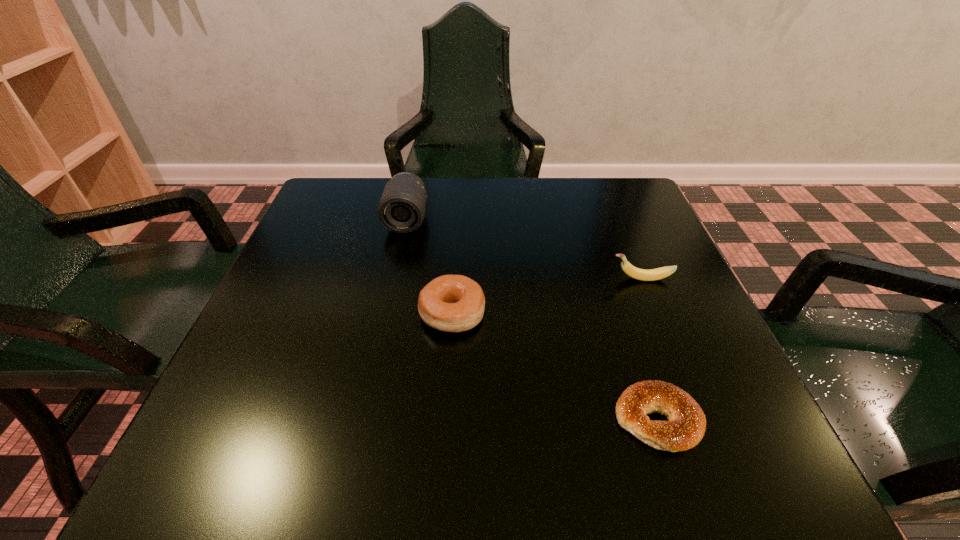
Locate an element on the screen. The height and width of the screenshot is (540, 960). free space between the third object from right to left and the third nearest object is located at coordinates (546, 296).

This screenshot has width=960, height=540. What are the coordinates of `empty space that is in between the leftmost object and the third nearest object` in the screenshot? It's located at (524, 249).

At what (x,y) coordinates should I click in order to perform the action: click on free spot between the second farthest object and the leftmost object. Please return your answer as a coordinate pair (x, y). Looking at the image, I should click on (524, 249).

At what (x,y) coordinates should I click in order to perform the action: click on vacant space in between the farthest object and the farther bagel. Please return your answer as a coordinate pair (x, y). The height and width of the screenshot is (540, 960). Looking at the image, I should click on (429, 267).

The width and height of the screenshot is (960, 540). Find the location of `empty space between the banana and the leftmost object`. empty space between the banana and the leftmost object is located at coordinates (524, 249).

Select which object is the third closest to the second farthest object. Please provide its 2D coordinates. Your answer should be formatted as a tuple, i.e. [(x, y)], where the tuple contains the x and y coordinates of a point satisfying the conditions above.

[(401, 209)]

Locate an element on the screen. This screenshot has height=540, width=960. the second closest object to the nearer bagel is located at coordinates pos(659,273).

Locate an element on the screen. The height and width of the screenshot is (540, 960). free space that satisfies the following two spatial constraints: 1. on the surface of the shortest object; 2. on the left side of the tallest object is located at coordinates (363, 419).

This screenshot has width=960, height=540. Find the location of `blank area in the image that satisfies the following two spatial constraints: 1. on the surface of the farther bagel; 2. on the left side of the tallest object`. blank area in the image that satisfies the following two spatial constraints: 1. on the surface of the farther bagel; 2. on the left side of the tallest object is located at coordinates (386, 314).

At what (x,y) coordinates should I click in order to perform the action: click on free space that satisfies the following two spatial constraints: 1. at the stem of the second farthest object; 2. on the front side of the left bagel. Please return your answer as a coordinate pair (x, y). Image resolution: width=960 pixels, height=540 pixels. Looking at the image, I should click on (656, 314).